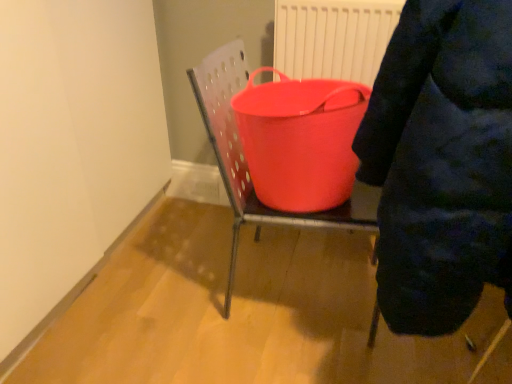
What do you see at coordinates (300, 139) in the screenshot? I see `rubberized red bucket at center` at bounding box center [300, 139].

In order to click on rubberized red bucket at center in this screenshot , I will do `click(300, 139)`.

Locate an element on the screen. rubberized red bucket at center is located at coordinates (300, 139).

Looking at this image, is dark blue puffer jacket at upper right taller than rubberized red bucket at center?

Indeed, dark blue puffer jacket at upper right has a greater height compared to rubberized red bucket at center.

Is dark blue puffer jacket at upper right positioned far away from rubberized red bucket at center?

That's not correct — dark blue puffer jacket at upper right is a little close to rubberized red bucket at center.

From the picture: Is rubberized red bucket at center surrounded by dark blue puffer jacket at upper right?

No.

In the image, is dark blue puffer jacket at upper right positioned in front of or behind rubberized red bucket at center?

Clearly, dark blue puffer jacket at upper right is in front of rubberized red bucket at center.

Which object is positioned more to the left, rubberized plastic bucket at center or rubberized red bucket at center?

rubberized red bucket at center.

Which is closer to the camera, (257, 198) or (249, 97)?

The point (257, 198) is more forward.

Which of these two, rubberized plastic bucket at center or rubberized red bucket at center, is wider?

With larger width is rubberized plastic bucket at center.

In terms of width, does rubberized plastic bucket at center look wider or thinner when compared to dark blue puffer jacket at upper right?

rubberized plastic bucket at center is thinner than dark blue puffer jacket at upper right.

Based on the photo, between rubberized plastic bucket at center and dark blue puffer jacket at upper right, which one is positioned behind?

rubberized plastic bucket at center is behind.

Locate an element on the screen. The height and width of the screenshot is (384, 512). furniture that appears above the dark blue puffer jacket at upper right (from the image's perspective) is located at coordinates (246, 160).

How different are the orientations of rubberized red bucket at center and dark blue puffer jacket at upper right in degrees?

The facing directions of rubberized red bucket at center and dark blue puffer jacket at upper right are 0.000889 degrees apart.

Is the surface of rubberized red bucket at center in direct contact with dark blue puffer jacket at upper right?

No, rubberized red bucket at center is not touching dark blue puffer jacket at upper right.

Is rubberized red bucket at center outside of dark blue puffer jacket at upper right?

Indeed, rubberized red bucket at center is completely outside dark blue puffer jacket at upper right.

From a real-world perspective, is rubberized red bucket at center under rubberized plastic bucket at center?

No.

Could you tell me if rubberized red bucket at center is facing rubberized plastic bucket at center?

Yes, rubberized red bucket at center is turned towards rubberized plastic bucket at center.

Is rubberized red bucket at center thinner than rubberized plastic bucket at center?

Indeed, rubberized red bucket at center has a lesser width compared to rubberized plastic bucket at center.

From the image's perspective, which is below, dark blue puffer jacket at upper right or rubberized plastic bucket at center?

dark blue puffer jacket at upper right is shown below in the image.

Relative to rubberized plastic bucket at center, is dark blue puffer jacket at upper right in front or behind?

Clearly, dark blue puffer jacket at upper right is in front of rubberized plastic bucket at center.

This screenshot has height=384, width=512. Identify the location of person to the right of rubberized plastic bucket at center. coord(442,162).

Is dark blue puffer jacket at upper right turned away from rubberized plastic bucket at center?

No, dark blue puffer jacket at upper right is not facing the opposite direction of rubberized plastic bucket at center.

Locate an element on the screen. The width and height of the screenshot is (512, 384). person below the rubberized red bucket at center (from the image's perspective) is located at coordinates (442, 162).

Identify the location of basin positioned vertically above the rubberized plastic bucket at center (from a real-world perspective). The width and height of the screenshot is (512, 384). (300, 139).

Looking at this image, from the image, which object appears to be nearer to rubberized red bucket at center, dark blue puffer jacket at upper right or rubberized plastic bucket at center?

The object closer to rubberized red bucket at center is rubberized plastic bucket at center.

Estimate the real-world distances between objects in this image. Which object is closer to rubberized red bucket at center, rubberized plastic bucket at center or dark blue puffer jacket at upper right?

rubberized plastic bucket at center is closer to rubberized red bucket at center.

Considering their positions, is rubberized red bucket at center positioned closer to dark blue puffer jacket at upper right than rubberized plastic bucket at center?

rubberized red bucket at center is closer to dark blue puffer jacket at upper right.

Considering their positions, is rubberized plastic bucket at center positioned further to dark blue puffer jacket at upper right than rubberized red bucket at center?

rubberized plastic bucket at center is further to dark blue puffer jacket at upper right.

From the image, which object appears to be nearer to rubberized plastic bucket at center, dark blue puffer jacket at upper right or rubberized red bucket at center?

rubberized red bucket at center.

Consider the image. Estimate the real-world distances between objects in this image. Which object is closer to rubberized plastic bucket at center, rubberized red bucket at center or dark blue puffer jacket at upper right?

rubberized red bucket at center.

Find the location of `furniture between dark blue puffer jacket at upper right and rubberized red bucket at center in the front-back direction`. furniture between dark blue puffer jacket at upper right and rubberized red bucket at center in the front-back direction is located at coordinates [x=246, y=160].